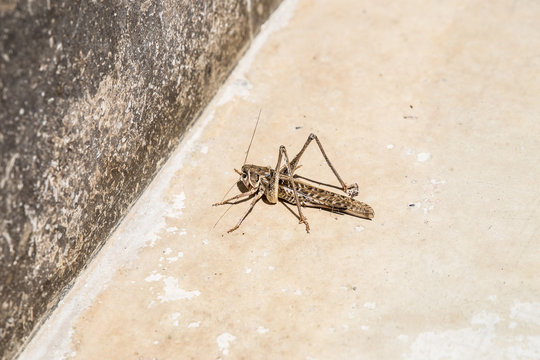
Image resolution: width=540 pixels, height=360 pixels. Identify the location of wall. (83, 52).